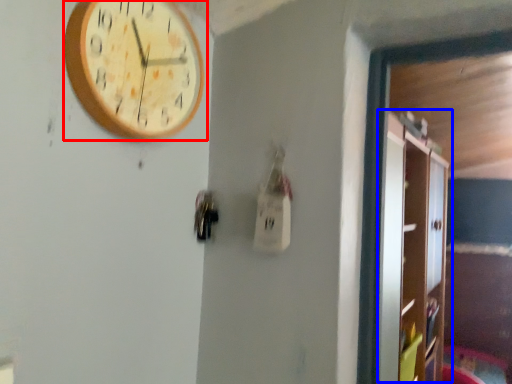
Question: Which object is closer to the camera taking this photo, wall clock (highlighted by a red box) or dresser (highlighted by a blue box)?

Choices:
 (A) wall clock
 (B) dresser

Answer: (A)